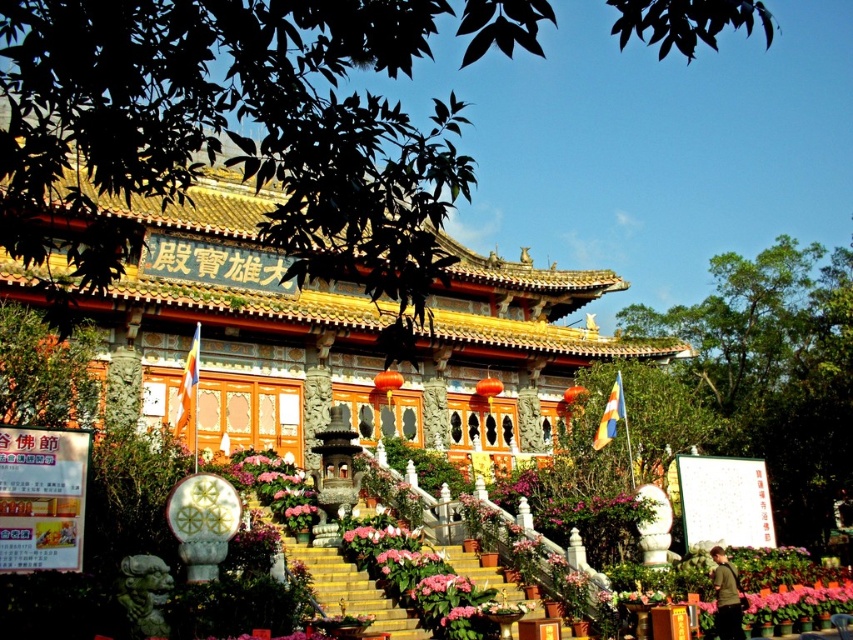
Is point (160, 392) positioned behind point (437, 577)?

Yes, point (160, 392) is farther from viewer.

Between golden ornate palace at center and pink matte flower at center, which one appears on the left side from the viewer's perspective?

pink matte flower at center is more to the left.

Is point (228, 364) positioned in front of point (445, 598)?

No, (228, 364) is further to viewer.

Locate an element on the screen. This screenshot has height=640, width=853. golden ornate palace at center is located at coordinates (341, 339).